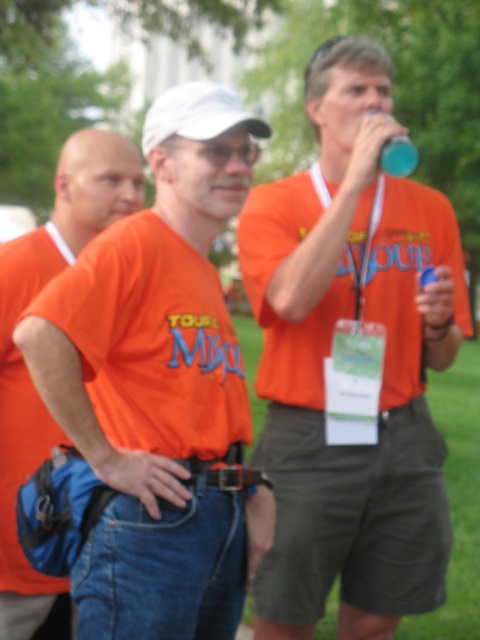
You are standing at the origin point of the coordinate system in the image. You need to locate the orange cotton shirt at center. Which direction should you move to reach it?

The orange cotton shirt at center is located at coordinate point 0.602 in the x direction and 0.331 in the y direction. Since you are at the origin, you should move right along the x axis to 0.602 and up along the y axis to 0.331 to reach it.

You are at a public event and see the matte orange shirt at center and the blue plastic cup at upper center. Which object is wider?

The matte orange shirt at center is wider than the blue plastic cup at upper center.